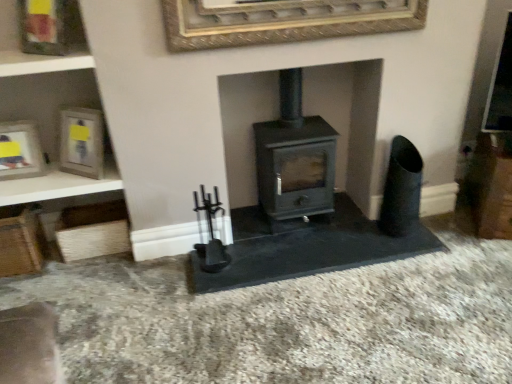
Question: Is there a large distance between gold textured picture frame at upper center, the fourth picture frame from the left, and wooden frame at upper left, the 2th picture frame from the left?

Choices:
 (A) no
 (B) yes

Answer: (A)

Question: Is gold textured picture frame at upper center, the fourth picture frame from the left, thinner than wooden frame at upper left, the 2th picture frame from the left?

Choices:
 (A) yes
 (B) no

Answer: (A)

Question: Is gold textured picture frame at upper center, acting as the first picture frame starting from the right, at the left side of wooden frame at upper left, the 2th picture frame from the left?

Choices:
 (A) yes
 (B) no

Answer: (B)

Question: Does gold textured picture frame at upper center, the fourth picture frame from the left, come in front of wooden frame at upper left, the 2th picture frame from the left?

Choices:
 (A) no
 (B) yes

Answer: (B)

Question: Is gold textured picture frame at upper center, the fourth picture frame from the left, shorter than wooden frame at upper left, the 2th picture frame from the left?

Choices:
 (A) no
 (B) yes

Answer: (B)

Question: From a real-world perspective, is gold textured picture frame at upper center, the fourth picture frame from the left, above or below wooden shelf at upper left?

Choices:
 (A) above
 (B) below

Answer: (A)

Question: Considering their positions, is gold textured picture frame at upper center, the fourth picture frame from the left, located in front of or behind wooden shelf at upper left?

Choices:
 (A) front
 (B) behind

Answer: (A)

Question: Is gold textured picture frame at upper center, the fourth picture frame from the left, inside or outside of wooden shelf at upper left?

Choices:
 (A) outside
 (B) inside

Answer: (A)

Question: In terms of width, does gold textured picture frame at upper center, the fourth picture frame from the left, look wider or thinner when compared to wooden shelf at upper left?

Choices:
 (A) wide
 (B) thin

Answer: (B)

Question: In the image, is gold textured picture frame at upper center, acting as the first picture frame starting from the right, on the left side or the right side of matte gray wood burning stove at center?

Choices:
 (A) right
 (B) left

Answer: (B)

Question: Considering the positions of gold textured picture frame at upper center, the fourth picture frame from the left, and matte gray wood burning stove at center in the image, is gold textured picture frame at upper center, the fourth picture frame from the left, wider or thinner than matte gray wood burning stove at center?

Choices:
 (A) thin
 (B) wide

Answer: (A)

Question: Considering the positions of gold textured picture frame at upper center, acting as the first picture frame starting from the right, and matte gray wood burning stove at center in the image, is gold textured picture frame at upper center, acting as the first picture frame starting from the right, bigger or smaller than matte gray wood burning stove at center?

Choices:
 (A) big
 (B) small

Answer: (B)

Question: From their relative heights in the image, would you say gold textured picture frame at upper center, the fourth picture frame from the left, is taller or shorter than matte gray wood burning stove at center?

Choices:
 (A) short
 (B) tall

Answer: (A)

Question: Considering the positions of wooden frame at upper left, the 2th picture frame from the left, and matte gray wood burning stove at center in the image, is wooden frame at upper left, the 2th picture frame from the left, bigger or smaller than matte gray wood burning stove at center?

Choices:
 (A) big
 (B) small

Answer: (B)

Question: Do you think wooden frame at upper left, the third picture frame when ordered from right to left, is within matte gray wood burning stove at center, or outside of it?

Choices:
 (A) inside
 (B) outside

Answer: (B)